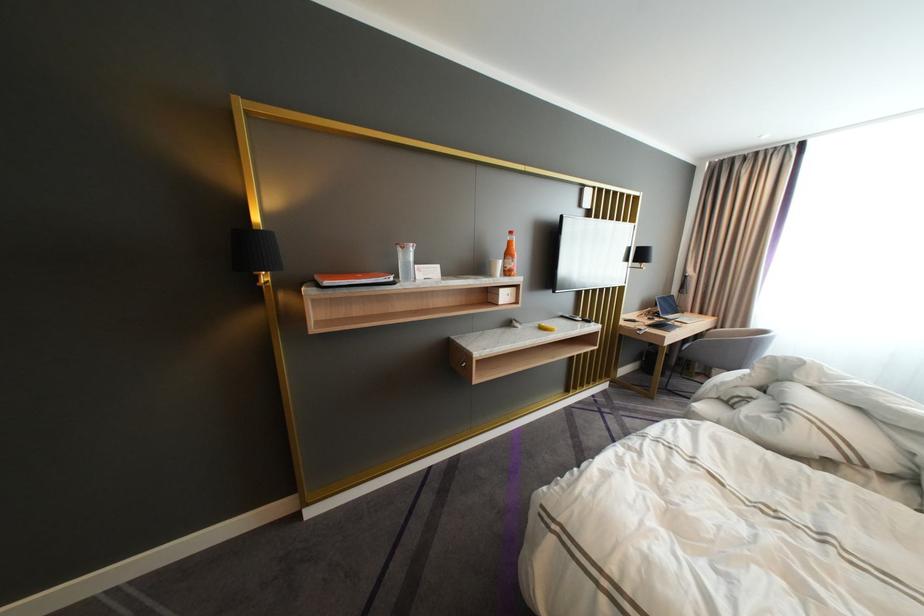
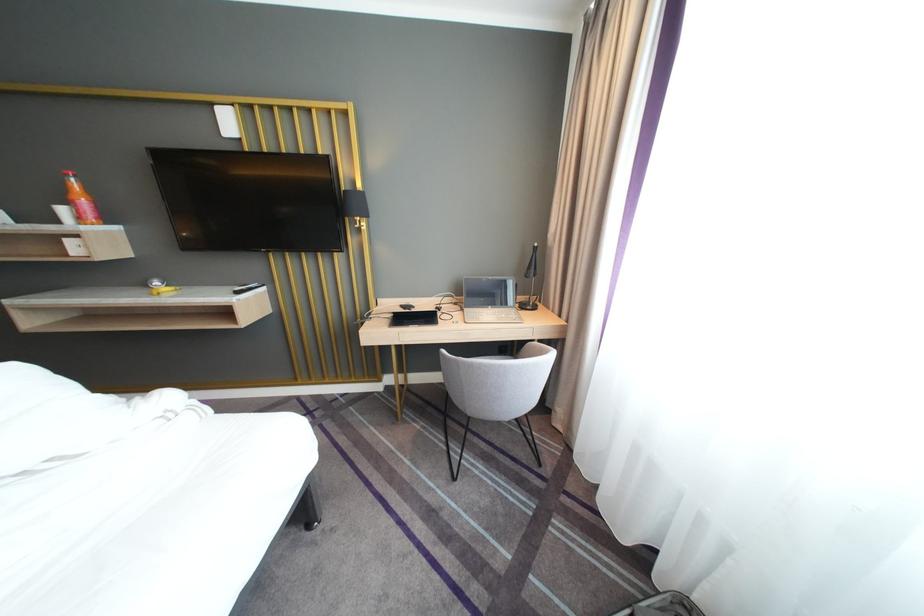
Based on the photo, what movement of the cameraman would produce the second image?

The cameraman moved toward right, forward.